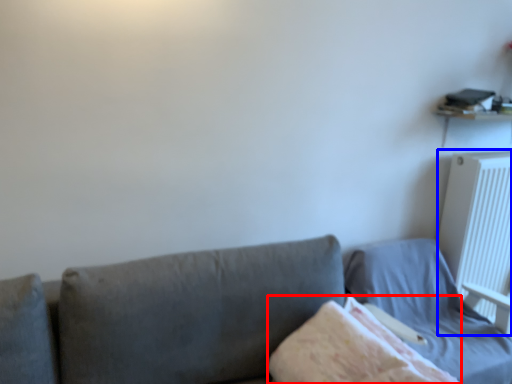
Question: Which object appears closest to the camera in this image, blanket (highlighted by a red box) or radiator (highlighted by a blue box)?

Choices:
 (A) blanket
 (B) radiator

Answer: (A)